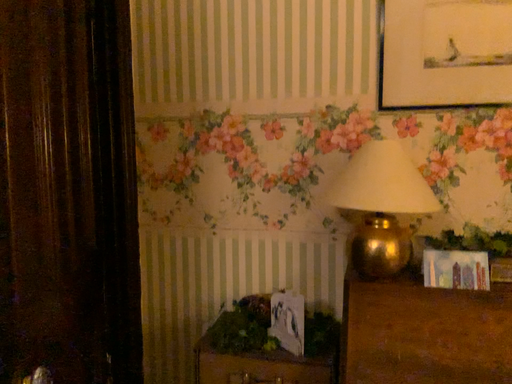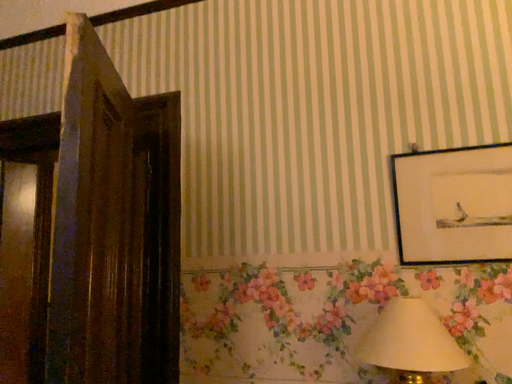
Question: How did the camera likely rotate when shooting the video?

Choices:
 (A) rotated upward
 (B) rotated downward

Answer: (A)